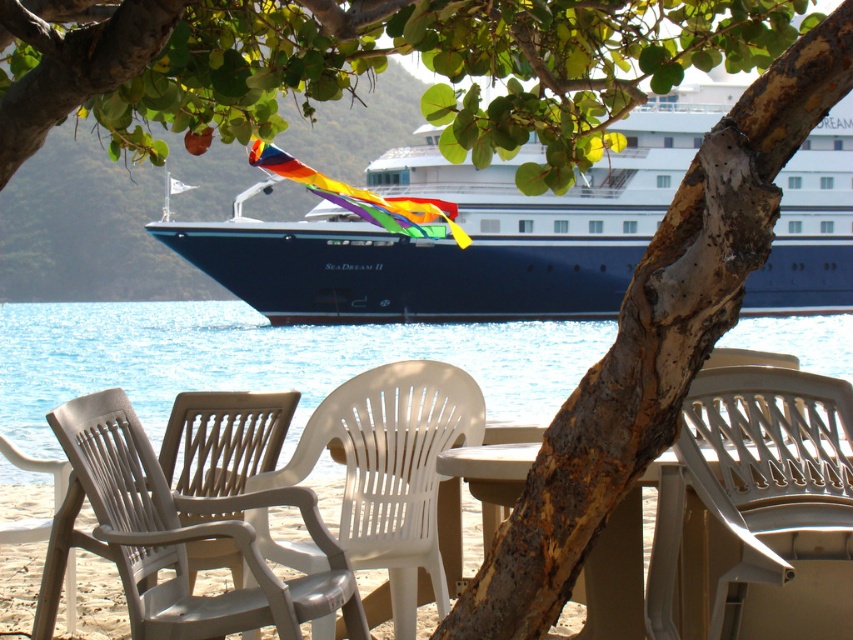
You are standing on the beach and want to take a photo of the blue glossy cruise ship at center. If you face directly towards the ship, which direction should you point your camera to capture it in the frame?

Since the blue glossy cruise ship at center is located at coordinates 0.362 on the x axis and 0.550 on the y axis, you should point your camera towards the center of the image to capture it in the frame.

You are a guest at the beachside dining area and want to place your drink on the white plastic chair at lower right. However, you notice the transparent plastic water at center. Is there enough space to place your drink on the chair without moving the existing water?

The transparent plastic water at center is above the white plastic chair at lower right, meaning it is placed on top of the chair. Therefore, there is no space to place your drink on the white plastic chair at lower right without moving the existing water.

You are standing at the edge of the beach looking towards the cruise ship. You see a white plastic chair at lower right and a white plastic beach chair at lower center. Which chair is closer to you?

The white plastic chair at lower right is closer to you because it is in front of the white plastic beach chair at lower center.